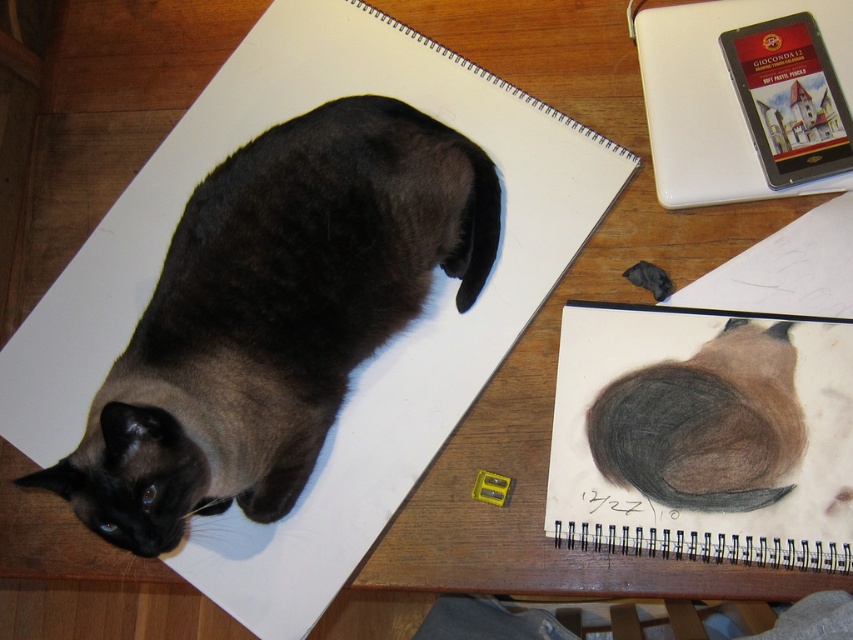
Is point (724, 474) farther from viewer compared to point (641, 36)?

No, it is not.

Who is more forward, (593, 422) or (701, 19)?

Point (593, 422) is more forward.

At what (x,y) coordinates should I click in order to perform the action: click on charcoal sketchbook at center. Please return your answer as a coordinate pair (x, y). This screenshot has width=853, height=640. Looking at the image, I should click on (701, 435).

Is dark brown fur cat at upper left bigger than charcoal sketchbook at center?

Yes, dark brown fur cat at upper left is bigger than charcoal sketchbook at center.

Who is lower down, dark brown fur cat at upper left or charcoal sketchbook at center?

charcoal sketchbook at center

Is point (167, 408) closer to camera compared to point (692, 369)?

Yes, point (167, 408) is in front of point (692, 369).

The width and height of the screenshot is (853, 640). What are the coordinates of `dark brown fur cat at upper left` in the screenshot? It's located at (276, 314).

Measure the distance between dark brown fur cat at upper left and white matte notebook at upper right.

15.21 inches

Is point (334, 186) closer to viewer compared to point (692, 49)?

That is True.

Identify the location of dark brown fur cat at upper left. This screenshot has width=853, height=640. (276, 314).